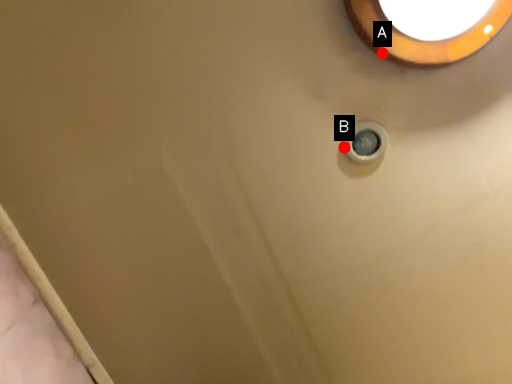
Question: Two points are circled on the image, labeled by A and B beside each circle. Which of the following is the closest to the observer?

Choices:
 (A) A is closer
 (B) B is closer

Answer: (A)